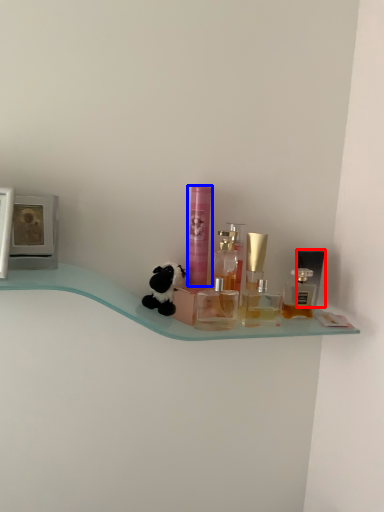
Question: Which of the following is the farthest to the observer, toiletry (highlighted by a red box) or toiletry (highlighted by a blue box)?

Choices:
 (A) toiletry
 (B) toiletry

Answer: (A)